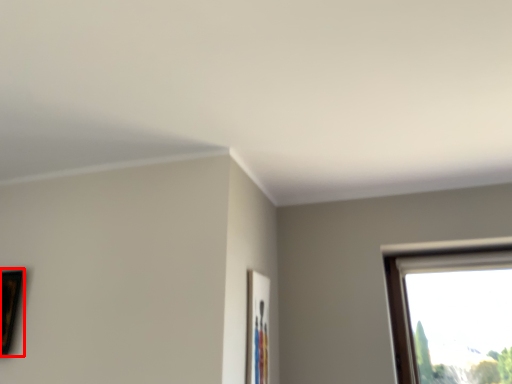
Question: Considering the relative positions of picture frame (annotated by the red box) and picture frame in the image provided, where is picture frame (annotated by the red box) located with respect to the staircase?

Choices:
 (A) left
 (B) right

Answer: (A)